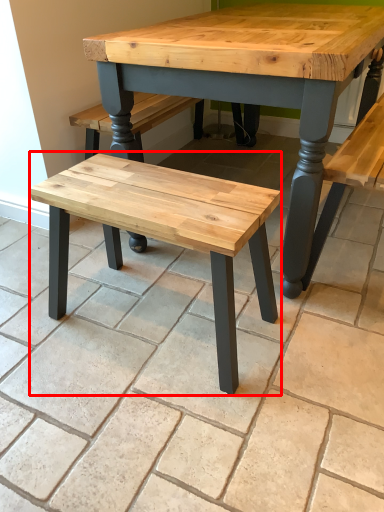
Question: Considering the relative positions of stool (annotated by the red box) and tile in the image provided, where is stool (annotated by the red box) located with respect to the staircase?

Choices:
 (A) left
 (B) right

Answer: (A)